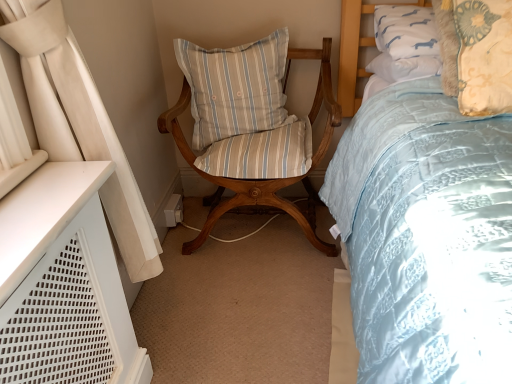
Locate an element on the screen. blank area beneath wooden chair with striped cushion at center (from a real-world perspective) is located at coordinates (253, 235).